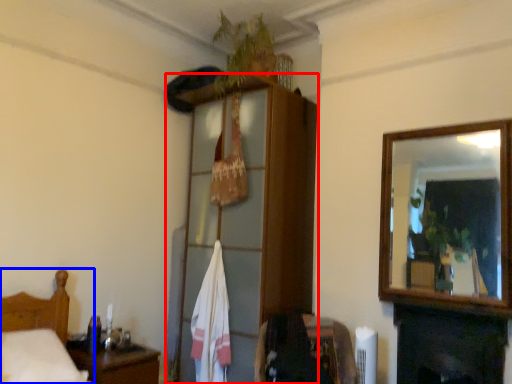
Question: Which of the following is the closest to the observer, dresser (highlighted by a red box) or furniture (highlighted by a blue box)?

Choices:
 (A) dresser
 (B) furniture

Answer: (B)